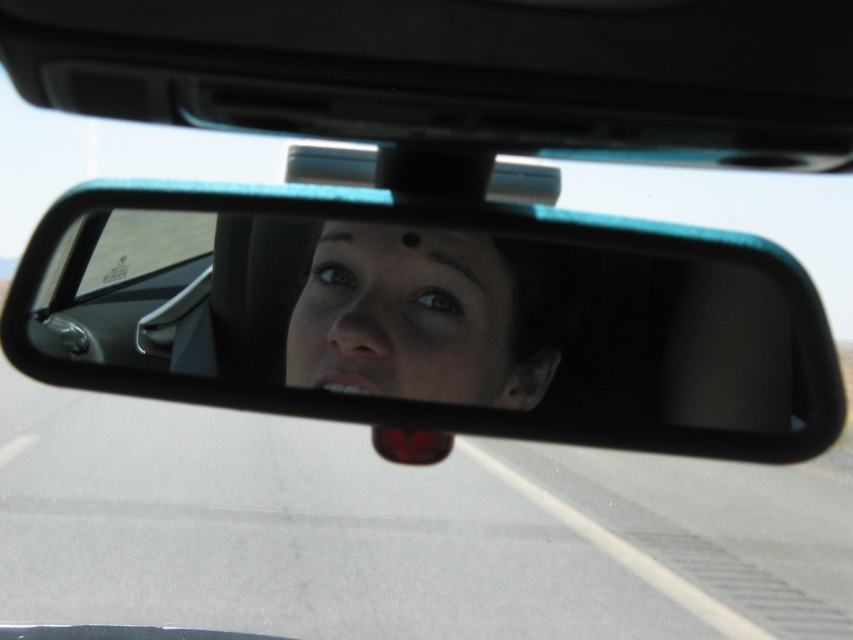
Between black plastic mirror at center and smooth skin face at center, which one has less height?

With less height is smooth skin face at center.

Can you confirm if black plastic mirror at center is positioned above smooth skin face at center?

No, black plastic mirror at center is not above smooth skin face at center.

Which is in front, point (628, 284) or point (384, 326)?

Point (384, 326) is in front.

Locate an element on the screen. black plastic mirror at center is located at coordinates (428, 316).